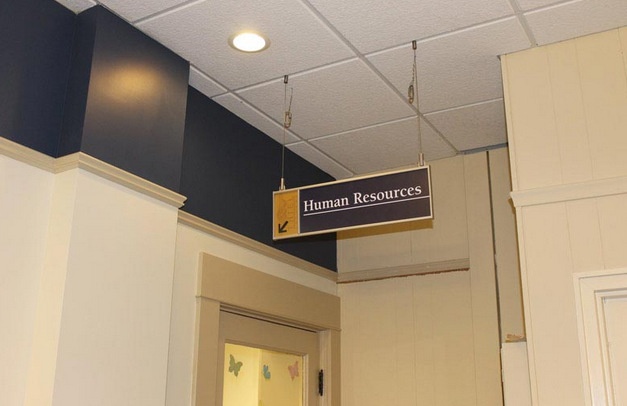
Find the location of `door hinge`. door hinge is located at coordinates (320, 378).